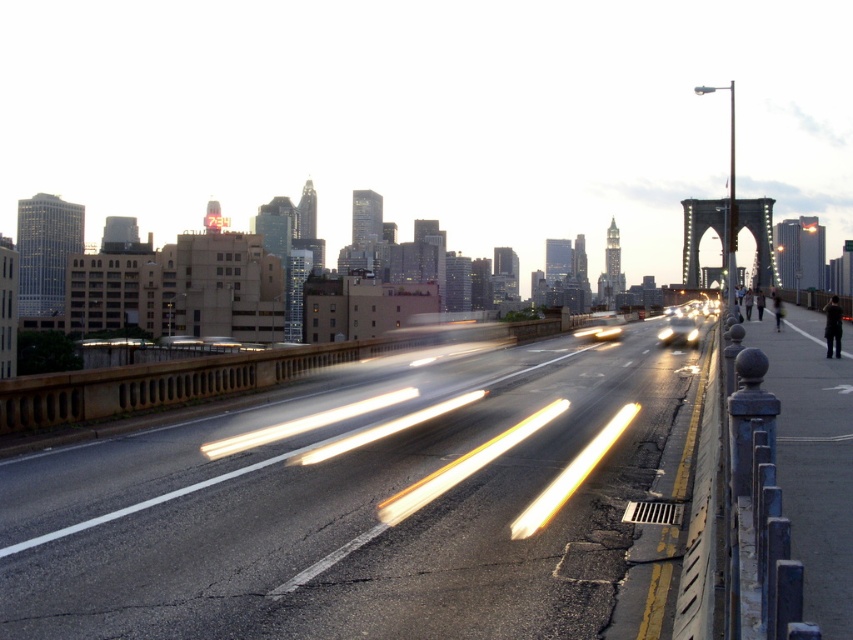
From the picture: Can you confirm if yellow/golden/stripes at center is positioned below white glossy light at center?

Correct, yellow/golden/stripes at center is located below white glossy light at center.

This screenshot has height=640, width=853. Identify the location of yellow/golden/stripes at center. (463, 465).

The image size is (853, 640). Describe the element at coordinates (355, 502) in the screenshot. I see `smooth asphalt highway at center` at that location.

Which of these two, smooth asphalt highway at center or white glossy light at center, stands shorter?

white glossy light at center

Does point (183, 451) come behind point (312, 460)?

Yes, it is.

Where is `smooth asphalt highway at center`? This screenshot has height=640, width=853. smooth asphalt highway at center is located at coordinates (355, 502).

Which is in front, point (390, 508) or point (526, 506)?

Point (390, 508) is more forward.

Is yellow/golden/stripes at center to the left of yellow translucent light at center from the viewer's perspective?

Yes, yellow/golden/stripes at center is to the left of yellow translucent light at center.

The height and width of the screenshot is (640, 853). What do you see at coordinates (463, 465) in the screenshot?
I see `yellow/golden/stripes at center` at bounding box center [463, 465].

This screenshot has width=853, height=640. In order to click on yellow/golden/stripes at center in this screenshot , I will do `click(463, 465)`.